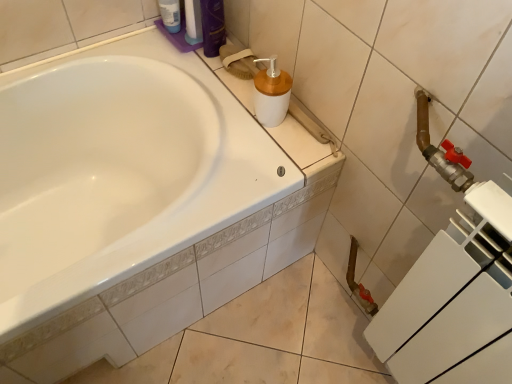
Question: In which direction should I rotate to look at shiny purple bottle at upper center, positioned as the second toiletry in left-to-right order?

Choices:
 (A) left
 (B) right

Answer: (A)

Question: Is white matte plastic soap dispenser at upper center taller than shiny purple bottle at upper center, positioned as the second toiletry in left-to-right order?

Choices:
 (A) yes
 (B) no

Answer: (B)

Question: Is there a large distance between white matte plastic soap dispenser at upper center and shiny purple bottle at upper center, positioned as the second toiletry in left-to-right order?

Choices:
 (A) no
 (B) yes

Answer: (A)

Question: Does white matte plastic soap dispenser at upper center turn towards shiny purple bottle at upper center, which is the 1th toiletry from right to left?

Choices:
 (A) no
 (B) yes

Answer: (A)

Question: From a real-world perspective, does white matte plastic soap dispenser at upper center sit lower than shiny purple bottle at upper center, positioned as the second toiletry in left-to-right order?

Choices:
 (A) yes
 (B) no

Answer: (A)

Question: Would you say white matte plastic soap dispenser at upper center contains shiny purple bottle at upper center, which is the 1th toiletry from right to left?

Choices:
 (A) yes
 (B) no

Answer: (B)

Question: Is white matte plastic soap dispenser at upper center at the left side of shiny purple bottle at upper center, which is the 1th toiletry from right to left?

Choices:
 (A) no
 (B) yes

Answer: (A)

Question: From a real-world perspective, is translucent plastic bottle at upper left, the first toiletry when ordered from left to right, physically above shiny purple bottle at upper center, which is the 1th toiletry from right to left?

Choices:
 (A) yes
 (B) no

Answer: (B)

Question: Does translucent plastic bottle at upper left, the second toiletry positioned from the right, have a lesser width compared to shiny purple bottle at upper center, which is the 1th toiletry from right to left?

Choices:
 (A) yes
 (B) no

Answer: (A)

Question: Is translucent plastic bottle at upper left, the second toiletry positioned from the right, completely or partially outside of shiny purple bottle at upper center, positioned as the second toiletry in left-to-right order?

Choices:
 (A) yes
 (B) no

Answer: (A)

Question: Considering the relative sizes of translucent plastic bottle at upper left, the first toiletry when ordered from left to right, and shiny purple bottle at upper center, positioned as the second toiletry in left-to-right order, in the image provided, is translucent plastic bottle at upper left, the first toiletry when ordered from left to right, smaller than shiny purple bottle at upper center, positioned as the second toiletry in left-to-right order,?

Choices:
 (A) no
 (B) yes

Answer: (B)

Question: Is shiny purple bottle at upper center, which is the 1th toiletry from right to left, at the back of translucent plastic bottle at upper left, the first toiletry when ordered from left to right?

Choices:
 (A) yes
 (B) no

Answer: (B)

Question: Considering the relative positions of translucent plastic bottle at upper left, the second toiletry positioned from the right, and shiny purple bottle at upper center, positioned as the second toiletry in left-to-right order, in the image provided, is translucent plastic bottle at upper left, the second toiletry positioned from the right, to the left of shiny purple bottle at upper center, positioned as the second toiletry in left-to-right order, from the viewer's perspective?

Choices:
 (A) no
 (B) yes

Answer: (B)

Question: Is shiny purple bottle at upper center, positioned as the second toiletry in left-to-right order, completely or partially outside of white matte plastic soap dispenser at upper center?

Choices:
 (A) yes
 (B) no

Answer: (A)